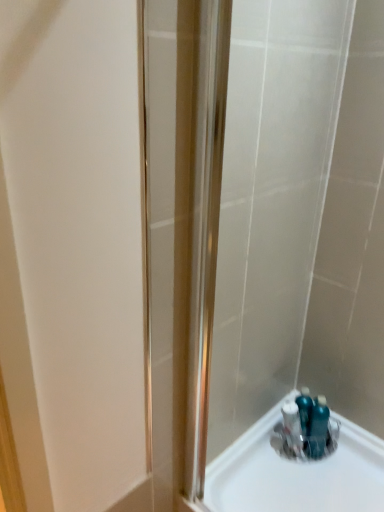
Question: From a real-world perspective, relative to clear plastic container at bottom right, the first sink viewed from the left, is satin nickel shower door at center vertically above or below?

Choices:
 (A) below
 (B) above

Answer: (B)

Question: Is satin nickel shower door at center bigger or smaller than clear plastic container at bottom right, the first sink viewed from the left?

Choices:
 (A) small
 (B) big

Answer: (B)

Question: Estimate the real-world distances between objects in this image. Which object is farther from the satin nickel shower door at center?

Choices:
 (A) blue glossy bottles at bottom right, the 2th sink in the left-to-right sequence
 (B) clear plastic container at bottom right, which ranks as the second sink in right-to-left order

Answer: (A)

Question: Which is nearer to the clear plastic container at bottom right, which ranks as the second sink in right-to-left order?

Choices:
 (A) satin nickel shower door at center
 (B) blue glossy bottles at bottom right, the 2th sink in the left-to-right sequence

Answer: (B)